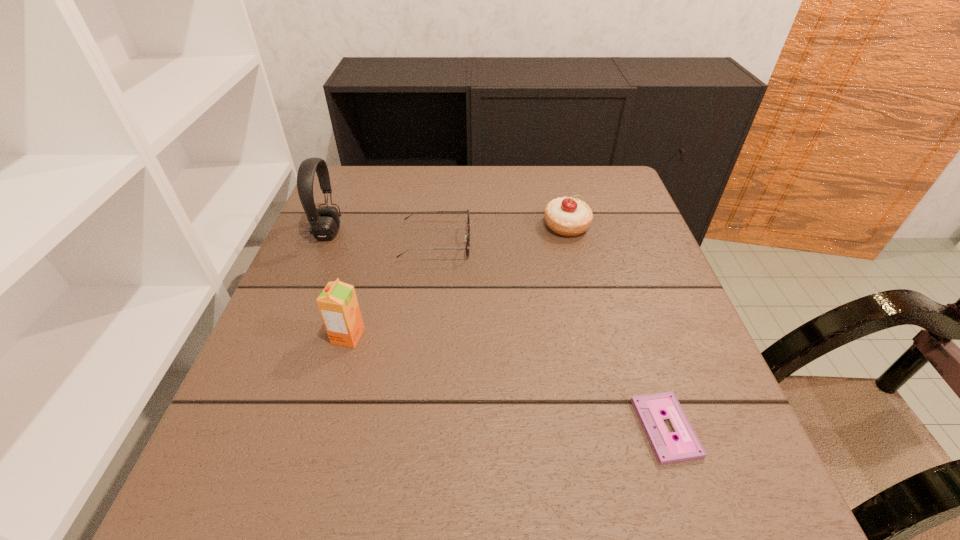
Locate an element on the screen. The image size is (960, 540). the tallest object is located at coordinates (324, 221).

Locate an element on the screen. the leftmost object is located at coordinates (324, 221).

Identify the location of the fourth object from right to left. The height and width of the screenshot is (540, 960). (338, 305).

Where is `orange juice`? orange juice is located at coordinates (338, 305).

The height and width of the screenshot is (540, 960). In order to click on pastry in this screenshot , I will do `click(566, 216)`.

In order to click on the third object from left to right in this screenshot , I will do `click(467, 234)`.

The image size is (960, 540). Find the location of `spectacles`. spectacles is located at coordinates (467, 234).

Find the location of a particular element. The image size is (960, 540). the nearest object is located at coordinates (649, 408).

Identify the location of the shortest object. (649, 408).

You are a GUI agent. You are given a task and a screenshot of the screen. Output one action in this format:
    pyautogui.click(x=<x>, y=<y>)
    Task: Click on the vacant area situated on the front-facing side of the tallest object
    
    Given the screenshot: What is the action you would take?
    (389, 232)